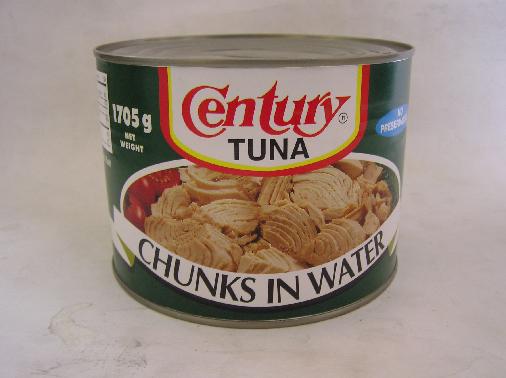
Identify the location of table. This screenshot has width=506, height=378. (276, 343).